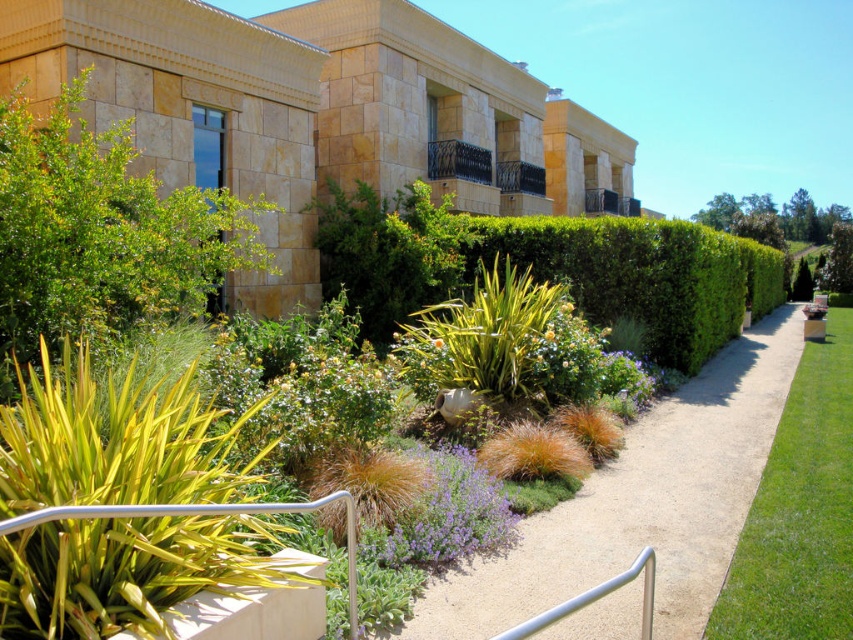
Based on the photo, you are standing at the entrance of the modern building and looking out at the garden. There are two points marked in the garden, point (453, 621) and point (373, 264). Which point is closer to you?

Point (453, 621) is closer to the camera than point (373, 264), so the point closer to you is point (453, 621).

You are a gardener who needs to mow the green leafy hedge at center and the smooth gravel path at center. Which one should you mow first based on their heights?

The smooth gravel path at center is not as tall as the green leafy hedge at center, so you should mow the green leafy hedge at center first since it is taller and may require attention before the path.